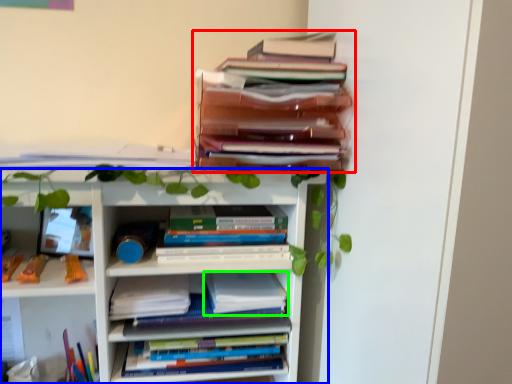
Question: Which object is the closest to the book (highlighted by a red box)? Choose among these: bookcase (highlighted by a blue box) or paperback book (highlighted by a green box).

Choices:
 (A) bookcase
 (B) paperback book

Answer: (A)